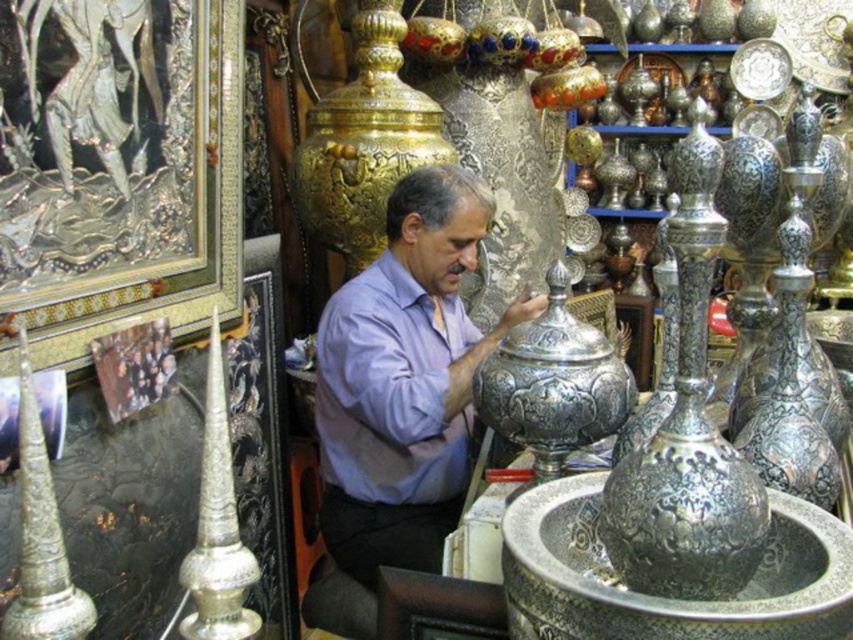
Can you confirm if purple matte shirt at center is positioned below purple matte dress shirt at center?

No.

The image size is (853, 640). What are the coordinates of `purple matte shirt at center` in the screenshot? It's located at (404, 380).

Who is lower down, polished silver vase at center-right or purple matte dress shirt at center?

purple matte dress shirt at center is lower down.

Can you confirm if polished silver vase at center-right is positioned to the left of purple matte dress shirt at center?

No, polished silver vase at center-right is not to the left of purple matte dress shirt at center.

Between point (740, 474) and point (346, 344), which one is positioned in front?

Positioned in front is point (740, 474).

I want to click on polished silver vase at center-right, so click(688, 432).

Looking at this image, is purple matte shirt at center to the left of polished silver vase at center-right from the viewer's perspective?

Yes, purple matte shirt at center is to the left of polished silver vase at center-right.

Is point (392, 374) closer to camera compared to point (712, 532)?

No, it is behind (712, 532).

Is point (409, 211) farther from camera compared to point (718, 480)?

Yes, point (409, 211) is behind point (718, 480).

At what (x,y) coordinates should I click in order to perform the action: click on purple matte shirt at center. Please return your answer as a coordinate pair (x, y). Looking at the image, I should click on (404, 380).